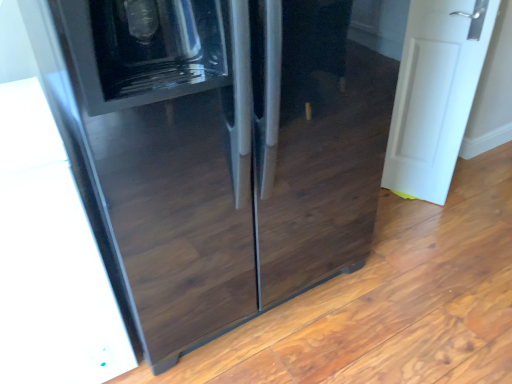
Locate an element on the screen. vacant space to the right of white matte door at right is located at coordinates (x=463, y=201).